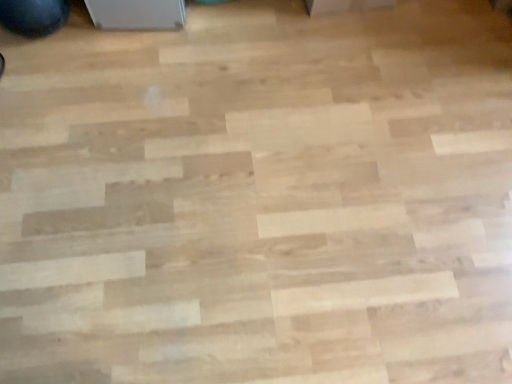
The image size is (512, 384). What do you see at coordinates (34, 16) in the screenshot?
I see `matte black shoe at upper left` at bounding box center [34, 16].

Find the location of `matte black shoe at upper left`. matte black shoe at upper left is located at coordinates (34, 16).

The image size is (512, 384). In order to click on matte black shoe at upper left in this screenshot , I will do [34, 16].